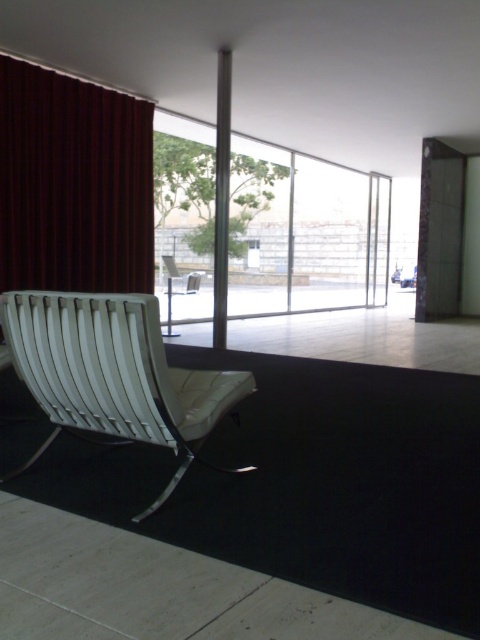
You are standing in the room and want to open the window to let in more light. The dark red velvet curtain at left is blocking the window. Can you reach the window if you move the curtain aside?

The dark red velvet curtain at left is positioned at point [72,182], so moving it aside would allow access to the window.

You are a delivery person trying to place a large package that is 2 meters wide between the dark red velvet curtain at left and the metallic silver chair at center. Can you fit the package without moving either object?

The dark red velvet curtain at left and metallic silver chair at center are 2.03 meters apart from each other. Since the package is 2 meters wide, it can fit between them as there is enough space.